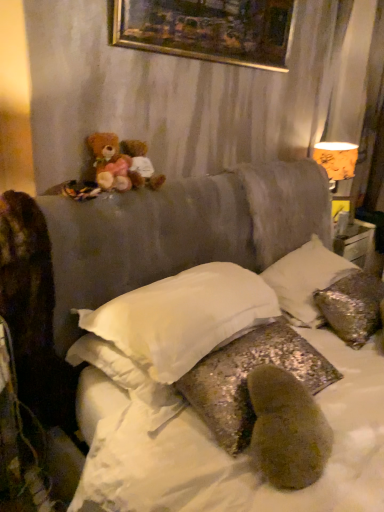
Question: In the image, is fluffy brown teddy bear at upper left, arranged as the 1th teddy bear when viewed from the right, positioned in front of or behind gold-framed painting at upper center?

Choices:
 (A) behind
 (B) front

Answer: (A)

Question: From a real-world perspective, is fluffy brown teddy bear at upper left, which appears as the second teddy bear when viewed from the left, physically located above or below gold-framed painting at upper center?

Choices:
 (A) below
 (B) above

Answer: (A)

Question: Considering the real-world distances, which object is farthest from the soft brown teddy bear at upper left, which appears as the second teddy bear when viewed from the right?

Choices:
 (A) gold-framed painting at upper center
 (B) fluffy brown teddy bear at upper left, arranged as the 1th teddy bear when viewed from the right
 (C) orange paper lampshade at upper right
 (D) silver sequined pillow at upper right, which is the 3th pillow from left to right
 (E) white soft pillow at center, marked as the first pillow in a left-to-right arrangement

Answer: (C)

Question: Considering the real-world distances, which object is closest to the white soft pillow at center, placed as the 3th pillow when sorted from right to left?

Choices:
 (A) soft brown teddy bear at upper left, the first teddy bear in the left-to-right sequence
 (B) silver sequined pillow at upper right, which is the 3th pillow from left to right
 (C) glittery sequined pillow at center, the 2th pillow from the left
 (D) fluffy brown teddy bear at upper left, arranged as the 1th teddy bear when viewed from the right
 (E) gold-framed painting at upper center

Answer: (C)